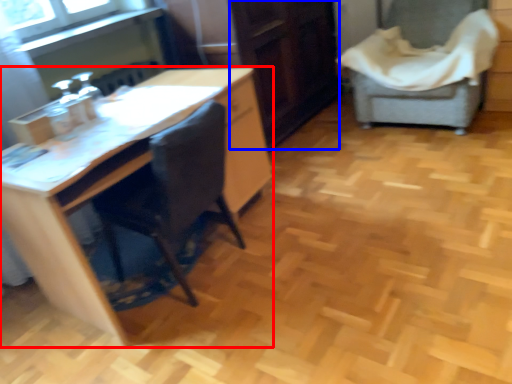
Question: Which object is closer to the camera taking this photo, desk (highlighted by a red box) or file cabinet (highlighted by a blue box)?

Choices:
 (A) desk
 (B) file cabinet

Answer: (A)